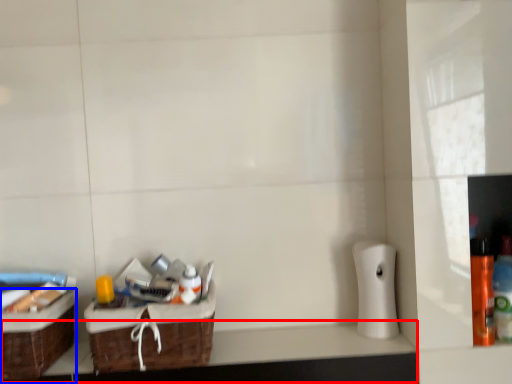
Question: Which of the following is the closest to the observer, counter top (highlighted by a red box) or box (highlighted by a blue box)?

Choices:
 (A) counter top
 (B) box

Answer: (B)